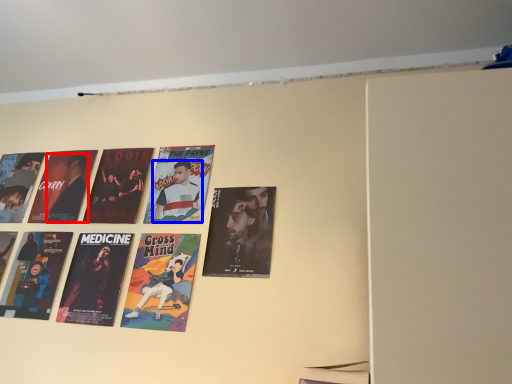
Question: Which object appears farthest to the camera in this image, person (highlighted by a red box) or person (highlighted by a blue box)?

Choices:
 (A) person
 (B) person

Answer: (A)